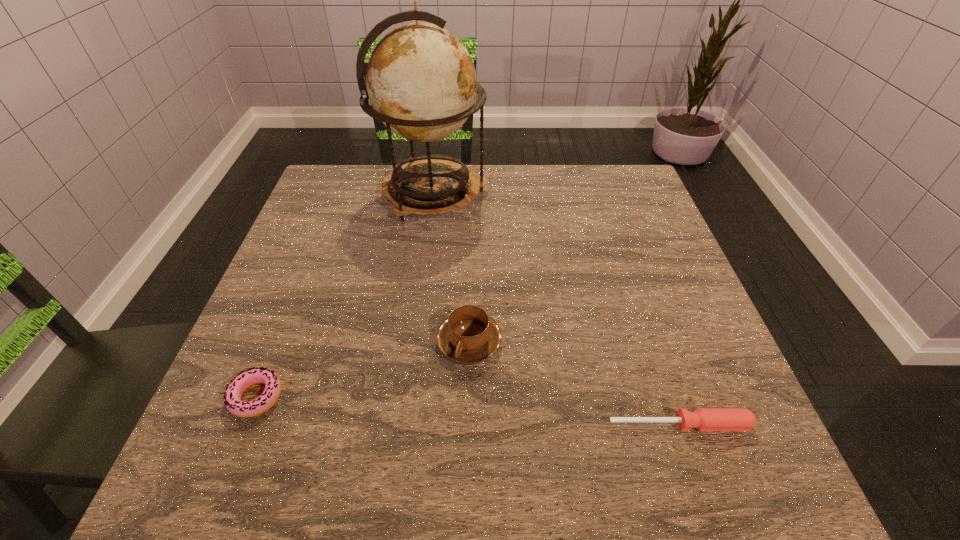
The image size is (960, 540). I want to click on blank space at the near right corner of the desktop, so click(676, 464).

This screenshot has width=960, height=540. Identify the location of unoccupied position between the rightmost object and the second tallest object. (574, 383).

The width and height of the screenshot is (960, 540). In order to click on free space between the cappuccino and the rightmost object in this screenshot , I will do `click(574, 383)`.

Identify the location of vacant area that lies between the doughnut and the farthest object. The height and width of the screenshot is (540, 960). (345, 295).

Locate an element on the screen. The height and width of the screenshot is (540, 960). free area in between the screwdriver and the cappuccino is located at coordinates (574, 383).

Identify the location of free spot between the cappuccino and the doughnut. 363,369.

Find the location of a particular element. empty space between the leftmost object and the rightmost object is located at coordinates (468, 410).

This screenshot has width=960, height=540. Identify the location of free space between the farthest object and the doughnut. (345, 295).

The image size is (960, 540). I want to click on free space between the doughnut and the screwdriver, so click(468, 410).

The image size is (960, 540). In order to click on empty space between the rightmost object and the farthest object in this screenshot , I will do `click(557, 309)`.